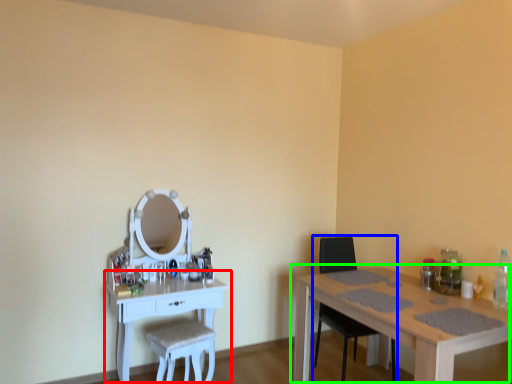
Question: Estimate the real-world distances between objects in this image. Which object is farther from table (highlighted by a red box), chair (highlighted by a blue box) or table (highlighted by a green box)?

Choices:
 (A) chair
 (B) table

Answer: (A)